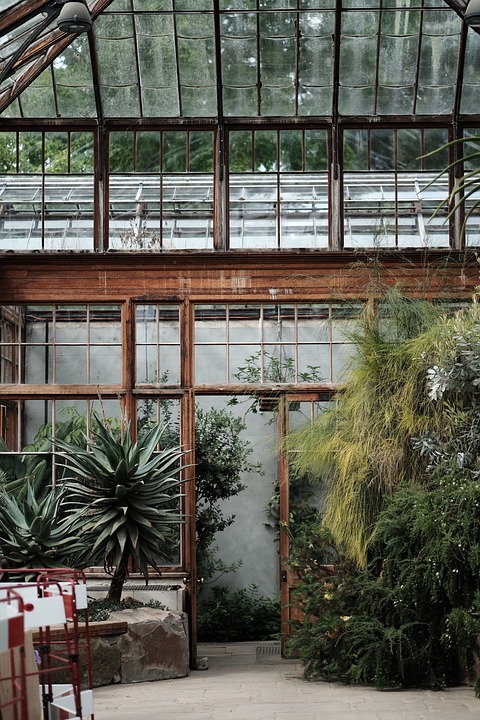
Image resolution: width=480 pixels, height=720 pixels. Find the location of `closed door`. closed door is located at coordinates (292, 590), (283, 500).